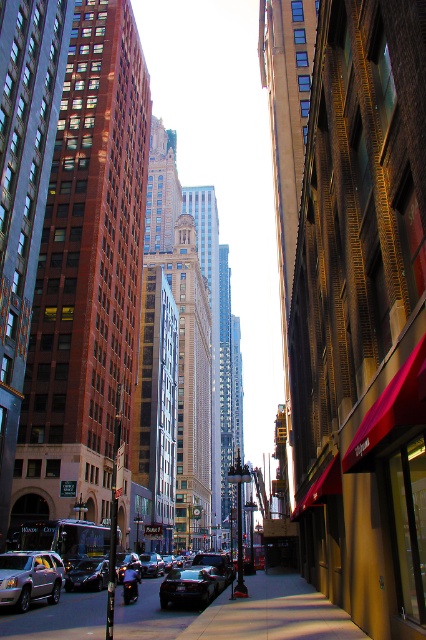
Is metallic silver sedan at lower left positioned at the back of silver metallic taxi at lower left?

Yes, it is behind silver metallic taxi at lower left.

Which is more to the left, metallic silver sedan at lower left or silver metallic taxi at lower left?

silver metallic taxi at lower left

Which is in front, point (68, 595) or point (28, 572)?

Point (28, 572) is in front.

You are a GUI agent. You are given a task and a screenshot of the screen. Output one action in this format:
    pyautogui.click(x=<x>, y=<y>)
    Task: Click on the metallic silver sedan at lower left
    The width and height of the screenshot is (426, 640).
    Given the screenshot: What is the action you would take?
    [184, 586]

Looking at this image, who is more distant from viewer, (54, 577) or (199, 602)?

Point (54, 577)

Is silver metallic taxi at lower left to the left of shiny black car at center from the viewer's perspective?

Indeed, silver metallic taxi at lower left is positioned on the left side of shiny black car at center.

Which is behind, point (46, 572) or point (161, 586)?

Point (161, 586)

The image size is (426, 640). Identify the location of silver metallic taxi at lower left. click(x=29, y=577).

Does concrete sidewalk at lower center have a lesser height compared to shiny black car at center?

Incorrect, concrete sidewalk at lower center's height does not fall short of shiny black car at center's.

From the picture: Does concrete sidewalk at lower center have a greater height compared to shiny black car at center?

Indeed, concrete sidewalk at lower center has a greater height compared to shiny black car at center.

The width and height of the screenshot is (426, 640). I want to click on concrete sidewalk at lower center, so click(273, 612).